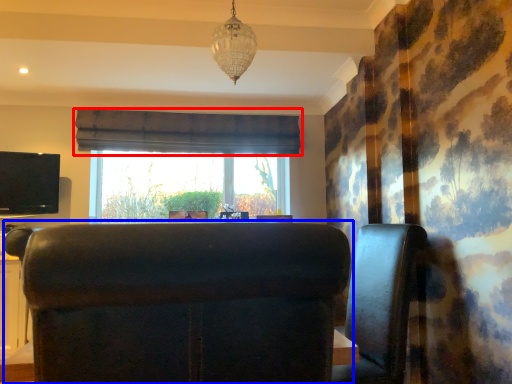
Question: Which point is further to the camera, curtain (highlighted by a red box) or furniture (highlighted by a blue box)?

Choices:
 (A) curtain
 (B) furniture

Answer: (A)